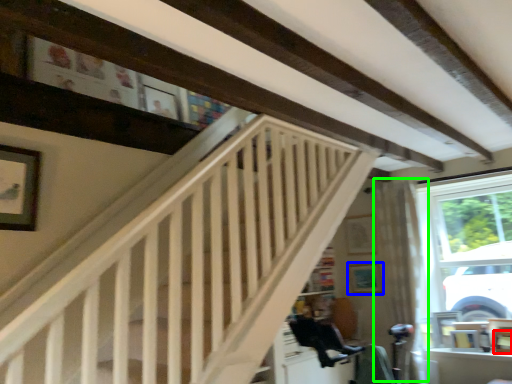
Question: Based on their relative distances, which object is nearer to picture frame (highlighted by a red box)? Choose from picture frame (highlighted by a blue box) and curtain (highlighted by a green box).

Choices:
 (A) picture frame
 (B) curtain

Answer: (B)